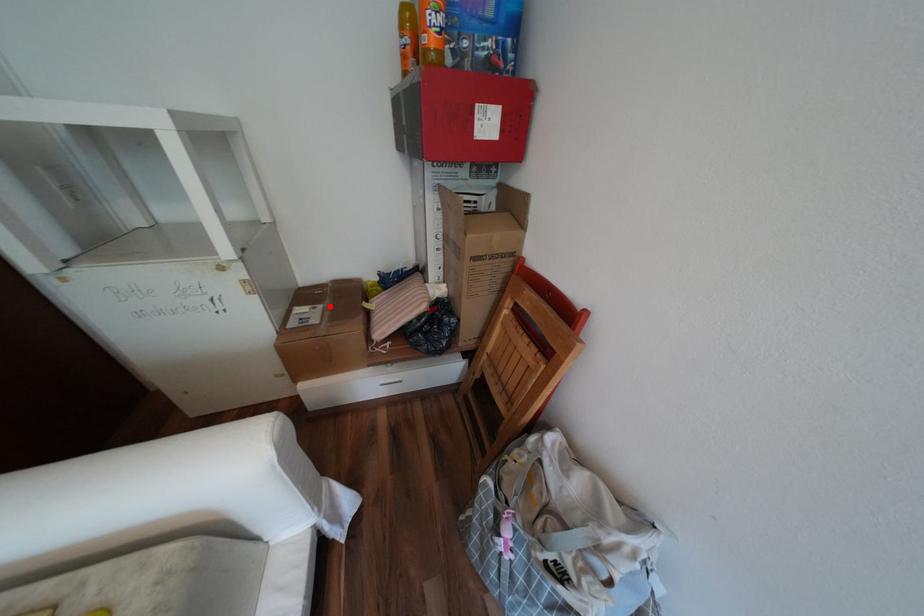
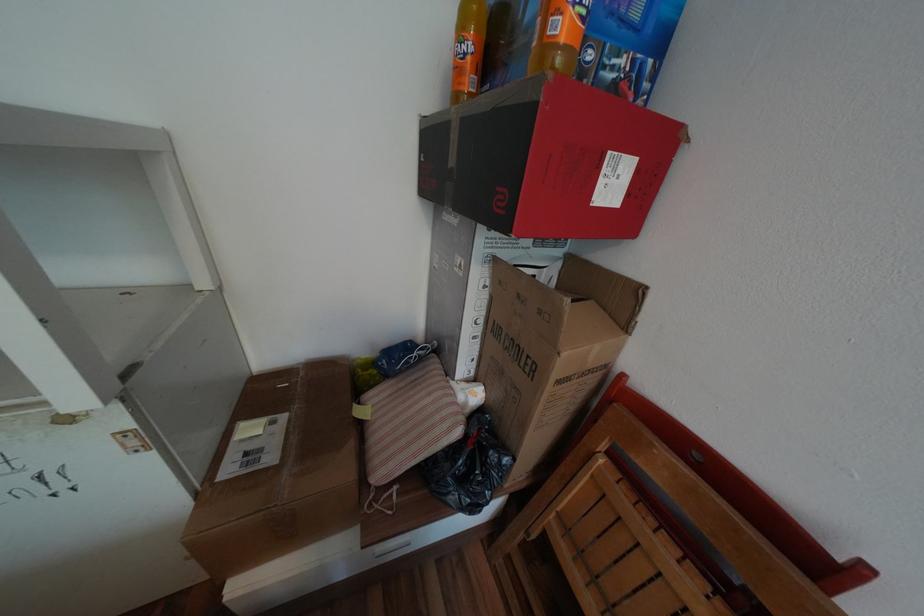
In the second image, find the point that corresponds to the highlighted location in the first image.

(293, 416)